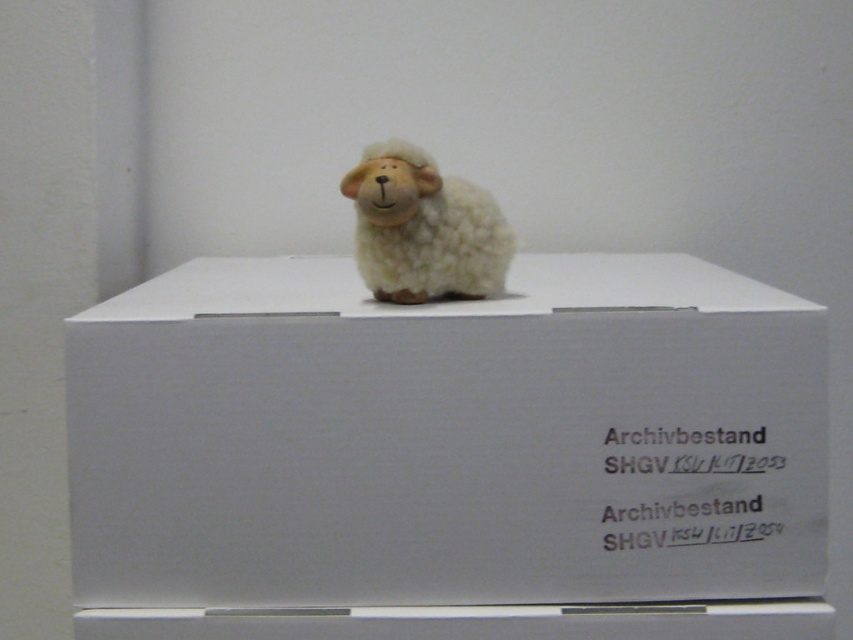
Can you confirm if white matte cardboard box at center is positioned to the left of fluffy white sheep at center?

In fact, white matte cardboard box at center is to the right of fluffy white sheep at center.

What do you see at coordinates (447, 438) in the screenshot? I see `white matte cardboard box at center` at bounding box center [447, 438].

Locate an element on the screen. white matte cardboard box at center is located at coordinates (447, 438).